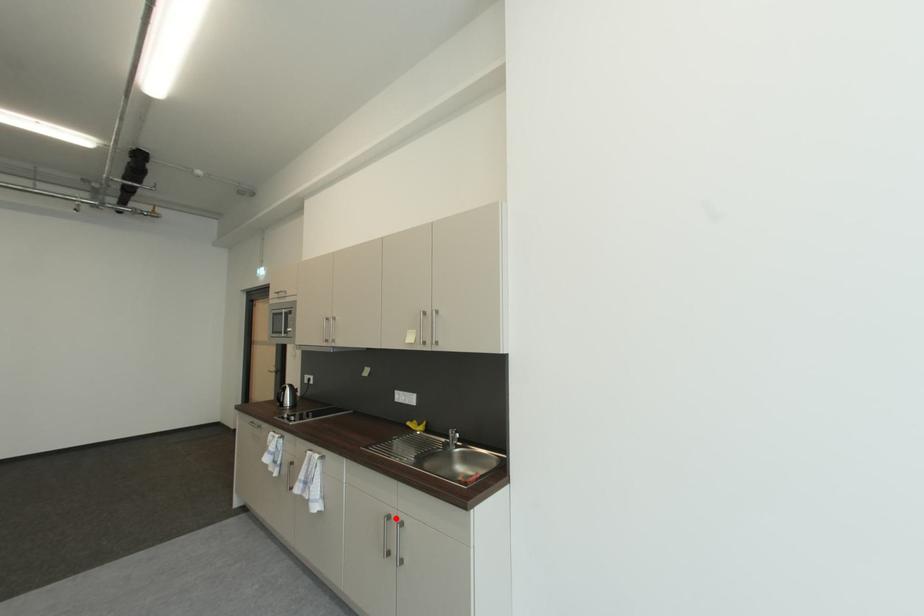
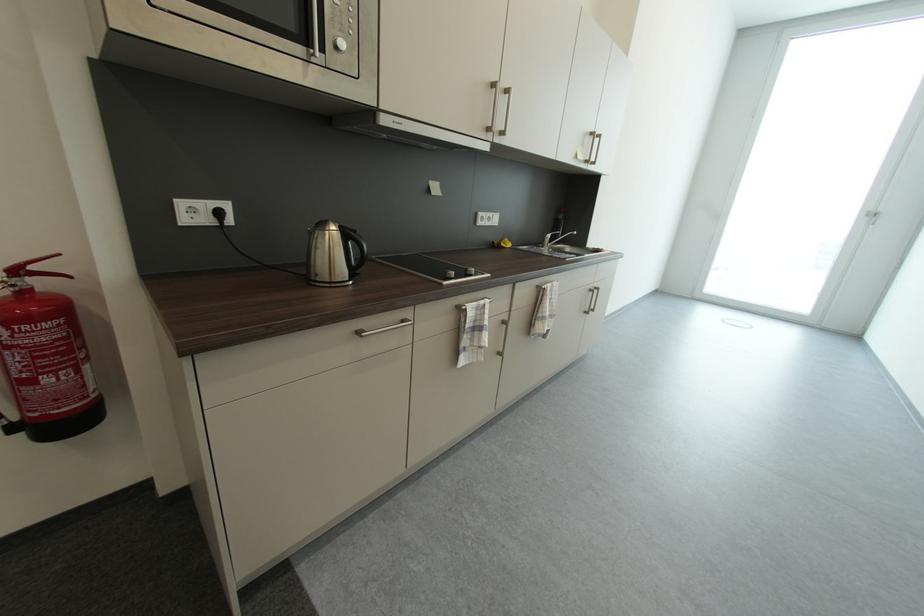
The point at the highlighted location is marked in the first image. Where is the corresponding point in the second image?

(598, 292)